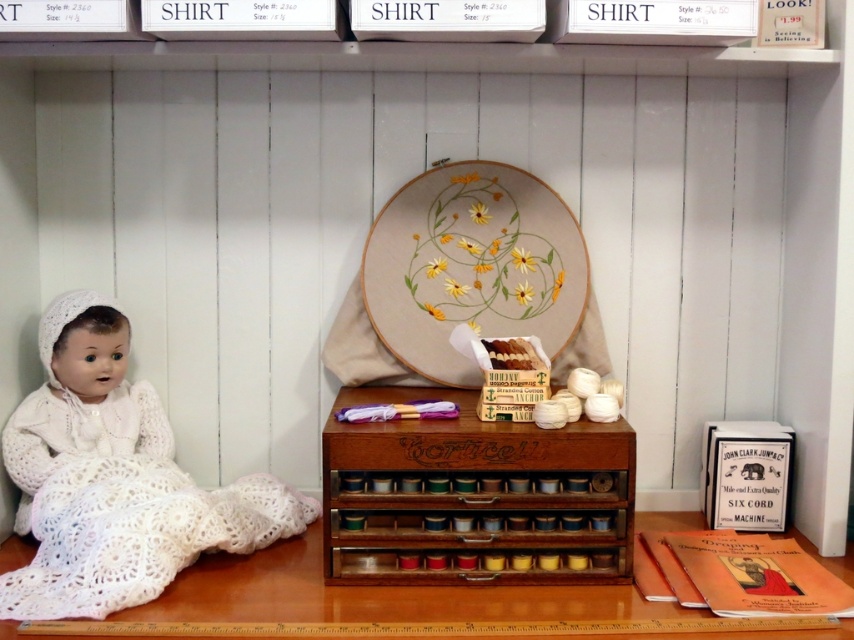
Question: Among these points, which one is farthest from the camera?

Choices:
 (A) (45, 448)
 (B) (534, 616)
 (C) (338, 476)

Answer: (A)

Question: Based on their relative distances, which object is nearer to the wooden table at lower center?

Choices:
 (A) wooden spool rack at center
 (B) white crocheted dress at left

Answer: (A)

Question: Is white crocheted dress at left smaller than wooden table at lower center?

Choices:
 (A) no
 (B) yes

Answer: (A)

Question: Which object is closer to the camera taking this photo?

Choices:
 (A) wooden table at lower center
 (B) white crocheted dress at left

Answer: (A)

Question: Can you confirm if white crocheted dress at left is wider than wooden table at lower center?

Choices:
 (A) yes
 (B) no

Answer: (B)

Question: Does wooden spool rack at center have a greater width compared to white crocheted dress at left?

Choices:
 (A) yes
 (B) no

Answer: (B)